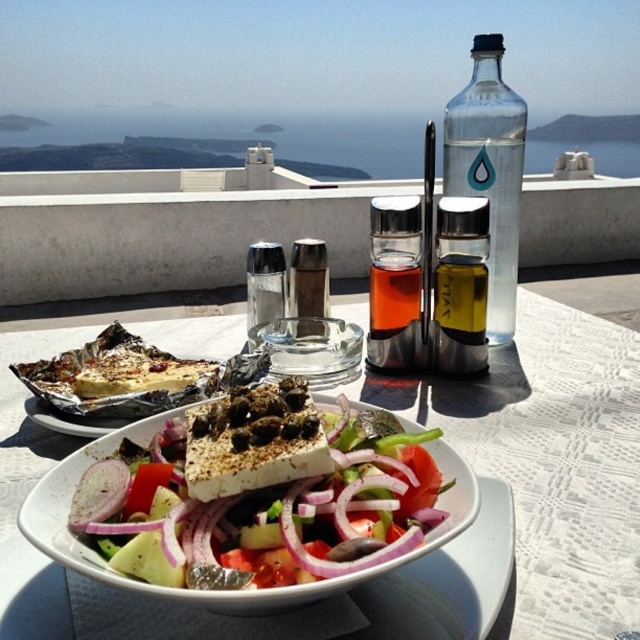
Question: Is white ceramic bowl at center in front of purple translucent onion at center?

Choices:
 (A) yes
 (B) no

Answer: (A)

Question: Considering the relative positions of white ceramic bowl at center and purple translucent onion at center in the image provided, where is white ceramic bowl at center located with respect to purple translucent onion at center?

Choices:
 (A) above
 (B) below

Answer: (A)

Question: Among these points, which one is farthest from the camera?

Choices:
 (A) (321, 259)
 (B) (472, 118)
 (C) (109, 481)
 (D) (541, 339)

Answer: (D)

Question: Which point appears closest to the camera in this image?

Choices:
 (A) (477, 298)
 (B) (72, 497)
 (C) (240, 339)

Answer: (B)

Question: Which object is positioned closest to the white ceramic bowl at center?

Choices:
 (A) purple translucent onion at center
 (B) translucent glass bottle at center

Answer: (B)

Question: In this image, where is transparent glass bottle at upper right located relative to clear glass salt shaker at center?

Choices:
 (A) below
 (B) above

Answer: (B)